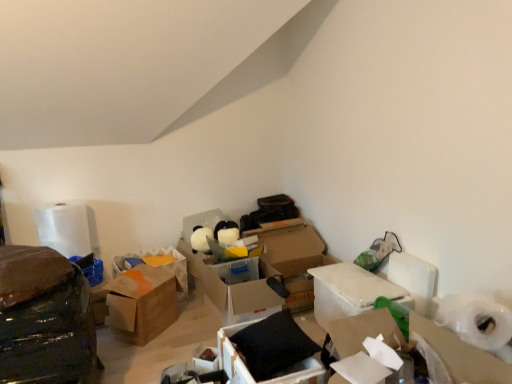
Question: Would you say shiny black plastic bag at left is to the left or to the right of translucent plastic container at center, which ranks as the third box in right-to-left order, in the picture?

Choices:
 (A) left
 (B) right

Answer: (A)

Question: Is shiny black plastic bag at left bigger or smaller than translucent plastic container at center, which is the third box in left-to-right order?

Choices:
 (A) small
 (B) big

Answer: (B)

Question: Estimate the real-world distances between objects in this image. Which object is closer to the cardboard box at lower right?

Choices:
 (A) shiny black plastic bag at left
 (B) black matte pillow at center, the 4th box in the left-to-right sequence
 (C) white cardboard box at center-right, which is the 1th box from right to left
 (D) brown cardboard box at center, the 1th box when ordered from left to right
 (E) matte cardboard box at center

Answer: (C)

Question: Which of these objects is positioned closest to the black matte pillow at center, which is the 2th box in right-to-left order?

Choices:
 (A) brown cardboard box at center, the 1th box when ordered from left to right
 (B) white cardboard box at center-right, which appears as the fifth box when viewed from the left
 (C) cardboard box at lower right
 (D) brown cardboard box at center, placed as the 4th box when sorted from right to left
 (E) white glossy toilet paper at upper left, the 2th toilet paper viewed from the right

Answer: (B)